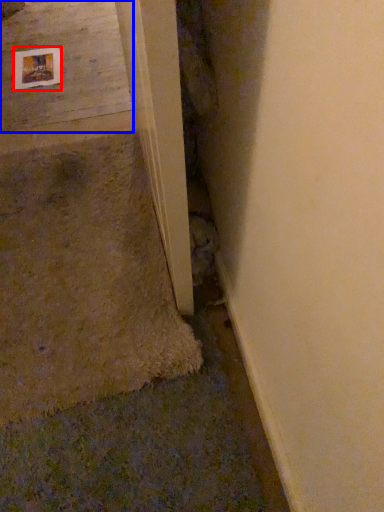
Question: Which object appears closest to the camera in this image, picture frame (highlighted by a red box) or concrete (highlighted by a blue box)?

Choices:
 (A) picture frame
 (B) concrete

Answer: (B)